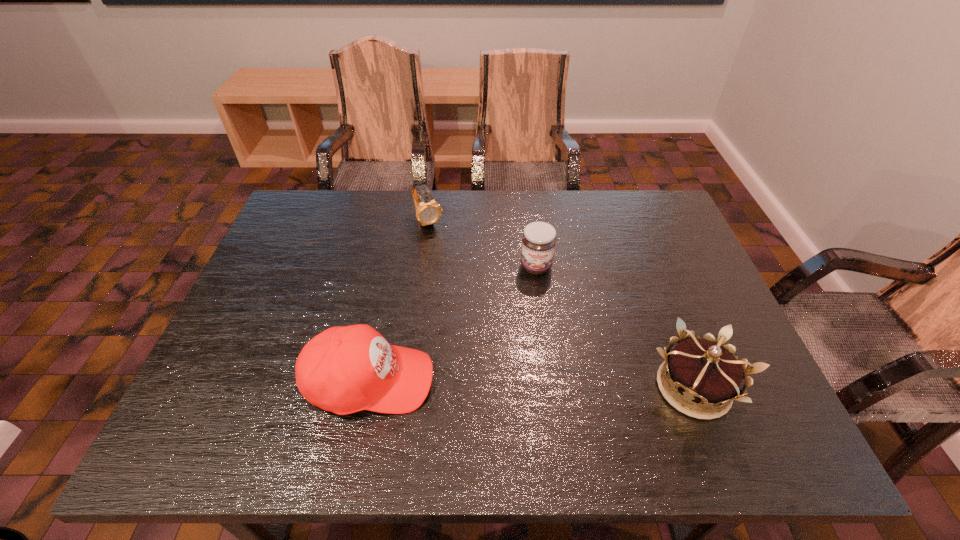
Identify the location of free space between the baseball cap and the crown. (532, 384).

You are a GUI agent. You are given a task and a screenshot of the screen. Output one action in this format:
    pyautogui.click(x=<x>, y=<y>)
    Task: Click on the vacant area that lies between the crown and the baseball cap
    
    Given the screenshot: What is the action you would take?
    pyautogui.click(x=532, y=384)

Image resolution: width=960 pixels, height=540 pixels. I want to click on free space between the farthest object and the baseball cap, so click(x=399, y=301).

Find the location of a particular element. The height and width of the screenshot is (540, 960). vacant area that lies between the crown and the jam is located at coordinates (614, 327).

Locate which object ranks in proximity to the second farthest object. Please provide its 2D coordinates. Your answer should be formatted as a tuple, i.e. [(x, y)], where the tuple contains the x and y coordinates of a point satisfying the conditions above.

[(428, 212)]

Locate which object is the second closest to the baseball cap. Please provide its 2D coordinates. Your answer should be formatted as a tuple, i.e. [(x, y)], where the tuple contains the x and y coordinates of a point satisfying the conditions above.

[(428, 212)]

Find the location of a particular element. free space that satisfies the following two spatial constraints: 1. on the front side of the watch; 2. on the left side of the third object from left to right is located at coordinates (422, 267).

Where is `vacant space that satisfies the following two spatial constraints: 1. on the front side of the jam; 2. on the right side of the farthest object`? vacant space that satisfies the following two spatial constraints: 1. on the front side of the jam; 2. on the right side of the farthest object is located at coordinates pos(422,267).